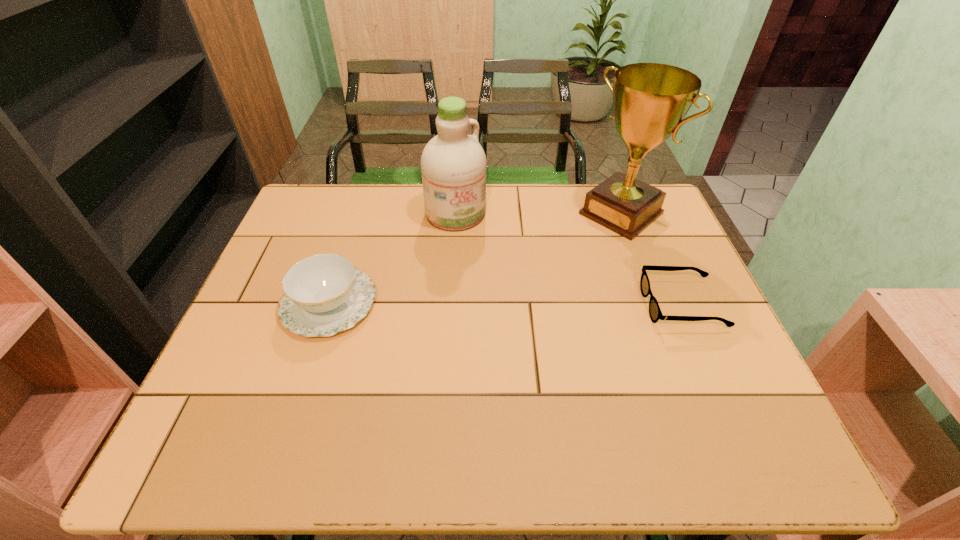
This screenshot has width=960, height=540. Find the location of `vacant space situated on the front label of the cleansing agent`. vacant space situated on the front label of the cleansing agent is located at coordinates (521, 300).

At what (x,y) coordinates should I click in order to perform the action: click on vacant region located on the front label of the cleansing agent. Please return your answer as a coordinate pair (x, y). The width and height of the screenshot is (960, 540). Looking at the image, I should click on (537, 319).

You are a GUI agent. You are given a task and a screenshot of the screen. Output one action in this format:
    pyautogui.click(x=<x>, y=<y>)
    Task: Click on the blank space located on the front label of the cleansing agent
    
    Given the screenshot: What is the action you would take?
    click(x=540, y=325)

Find the location of a particular element. This screenshot has width=960, height=540. free space located 0.380m on the plaque of the award is located at coordinates (509, 300).

Identify the location of free space located on the plaque of the award. (527, 286).

In order to click on vacant space situated 0.070m on the plaque of the award in this screenshot , I will do `click(582, 243)`.

Where is `cleansing agent at the far edge`? cleansing agent at the far edge is located at coordinates (453, 164).

At what (x,y) coordinates should I click in order to perform the action: click on award that is positioned at the far edge. Please return your answer as a coordinate pair (x, y). This screenshot has width=960, height=540. Looking at the image, I should click on 650,100.

Locate an element on the screen. Image resolution: width=960 pixels, height=540 pixels. object that is at the left edge is located at coordinates (324, 294).

At what (x,y) coordinates should I click in order to perform the action: click on spectacles situated at the right edge. Please return your answer as a coordinate pair (x, y). Looking at the image, I should click on (655, 313).